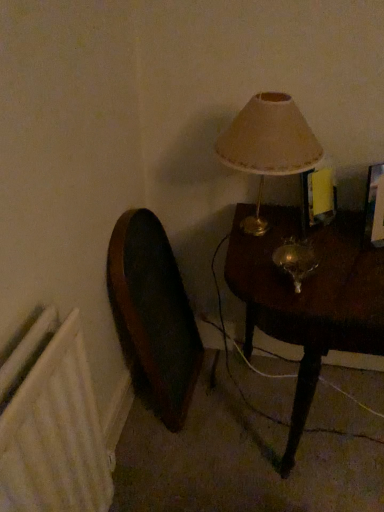
Image resolution: width=384 pixels, height=512 pixels. What are the coordinates of `vacant space underneath matte beige lampshade at upper right (from a real-world perspective)` in the screenshot? It's located at (274, 231).